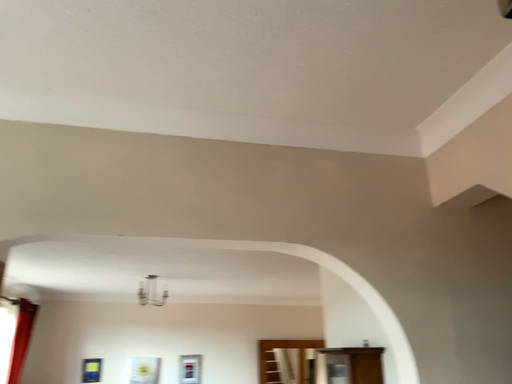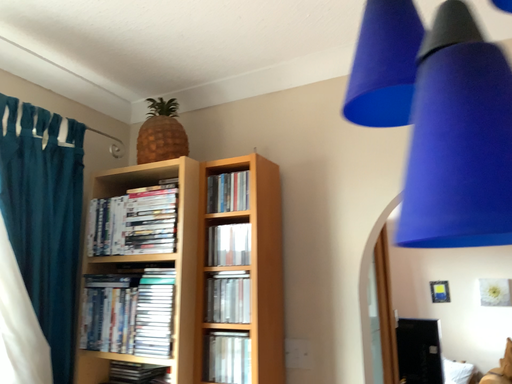
Question: Which way did the camera rotate in the video?

Choices:
 (A) rotated upward
 (B) rotated downward

Answer: (B)